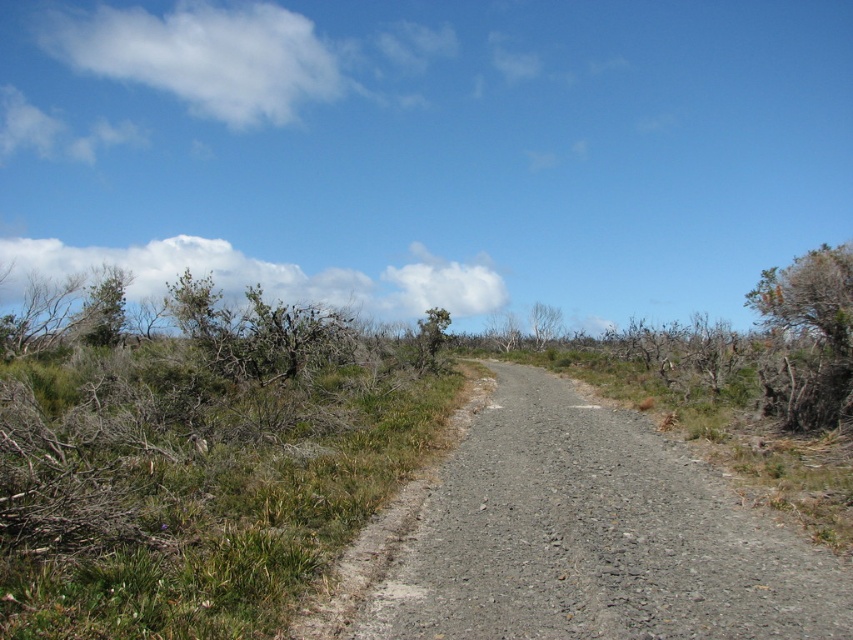
Question: Is brown textured bush at right below bare branches at center?

Choices:
 (A) no
 (B) yes

Answer: (A)

Question: Can you confirm if brown textured bush at right is bigger than bare branches at center?

Choices:
 (A) yes
 (B) no

Answer: (A)

Question: Which point is closer to the camera?

Choices:
 (A) bare branches at center
 (B) brown textured bush at right

Answer: (B)

Question: In this image, where is brown textured bush at right located relative to bare branches at center?

Choices:
 (A) below
 (B) above

Answer: (B)